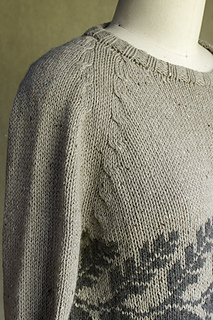
The width and height of the screenshot is (213, 320). Find the location of `wall\`. wall\ is located at coordinates (21, 26).